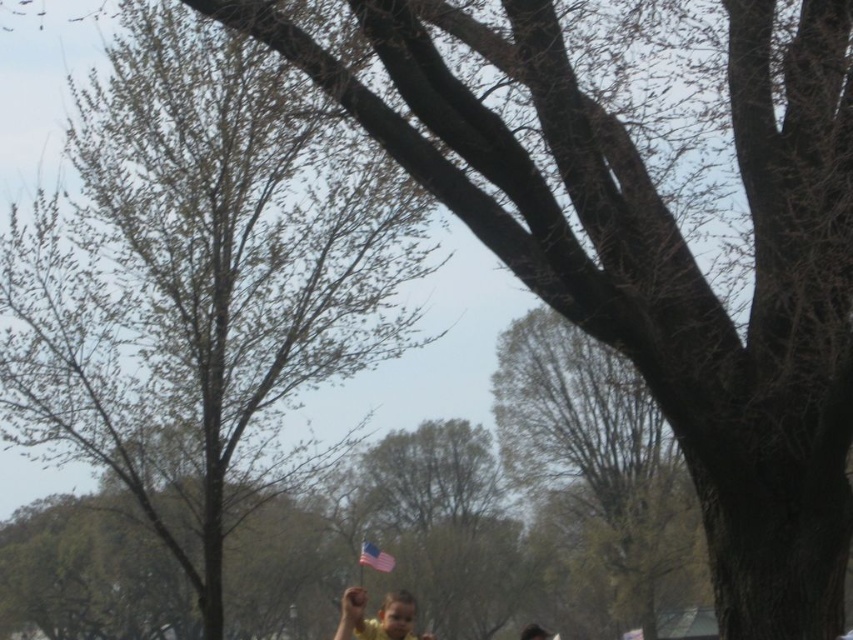
You are standing in the middle of a forest path and see two points marked in the image. The first point is at coordinate point [308,292] and the second is at point [659,412]. Which point is closer to you?

Point [308,292] is closer to the camera than point [659,412], so the first point is closer to you.

You are standing in the outdoor scene described. There is a point marked at coordinates (602, 464). Which object in the scene does this point correspond to?

The point at coordinates (602, 464) corresponds to the smooth bark tree at center.